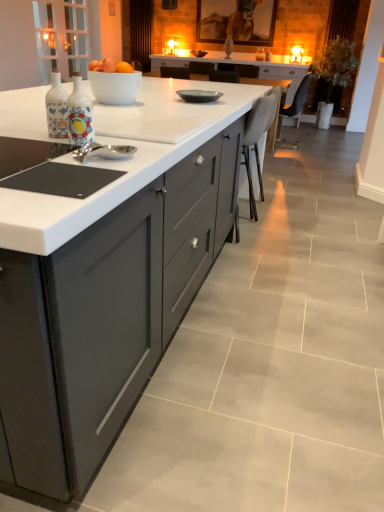
Identify the location of free location in front of decorative ceramic bottle at center-left. (70, 158).